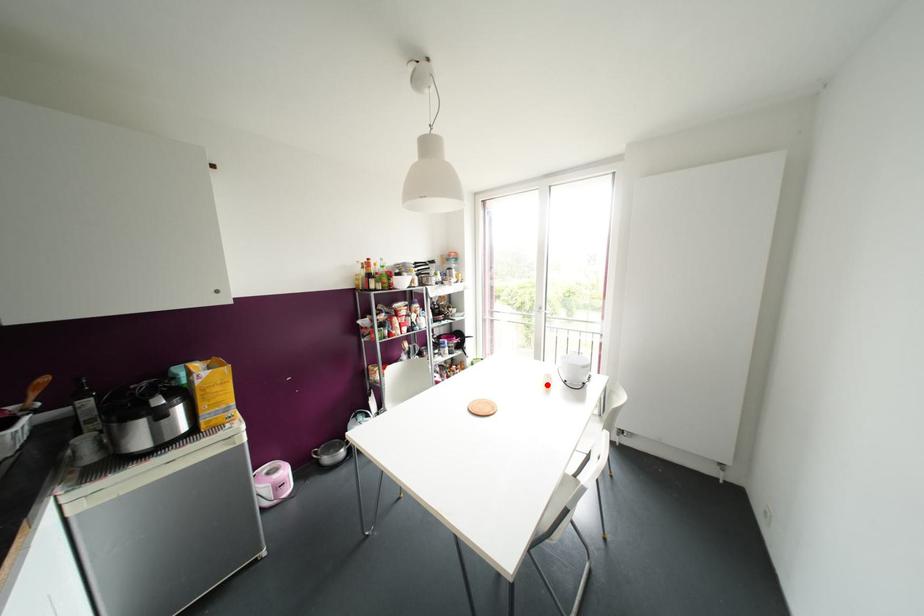
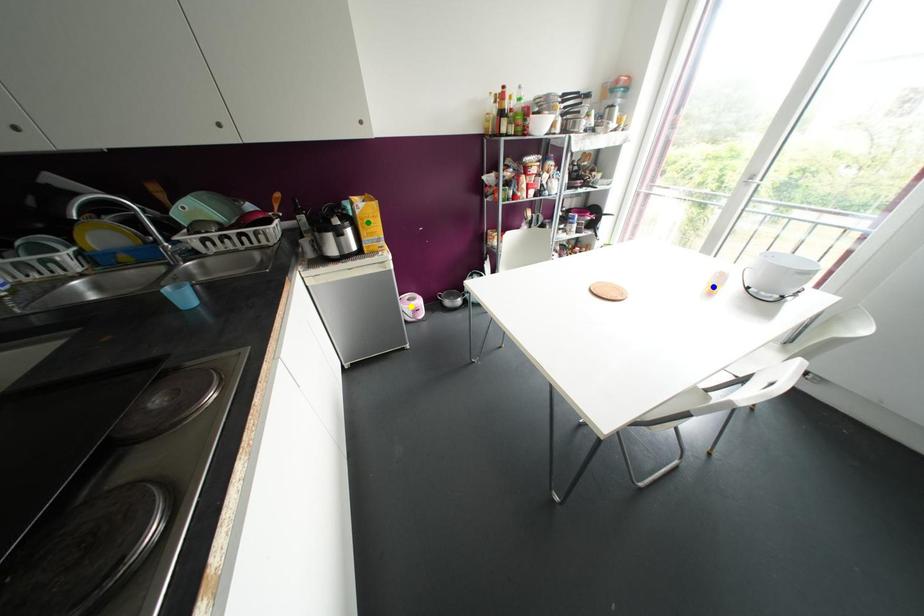
Question: I am providing you with two images of the same scene from different viewpoints. A red point is marked on the first image. You are given multiple points on the second image. In image 2, which mark is for the same physical point as the one in image 1?

Choices:
 (A) yellow point
 (B) green point
 (C) blue point

Answer: (C)